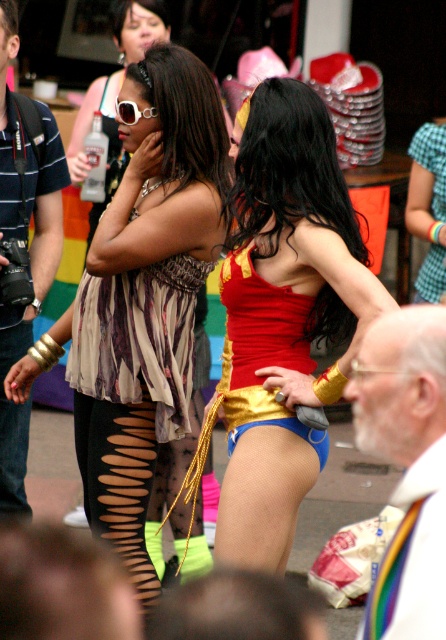
You are a photographer at the event and want to capture a picture of the matte brown dress at center. Where should you aim your camera to ensure the dress is in the frame?

The matte brown dress at center is located at point coordinates 0.528 in the x axis and 0.312 in the y axis, so you should aim your camera at those coordinates to capture the dress in the frame.